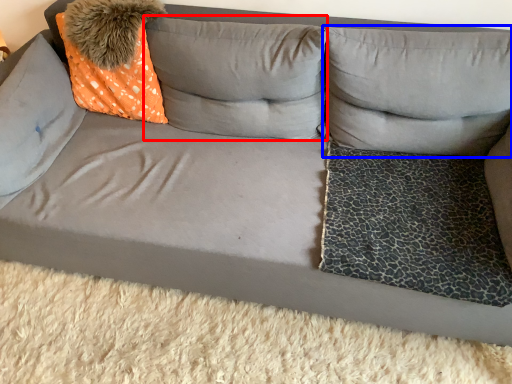
Question: Which of the following is the farthest to the observer, pillow (highlighted by a red box) or pillow (highlighted by a blue box)?

Choices:
 (A) pillow
 (B) pillow

Answer: (A)